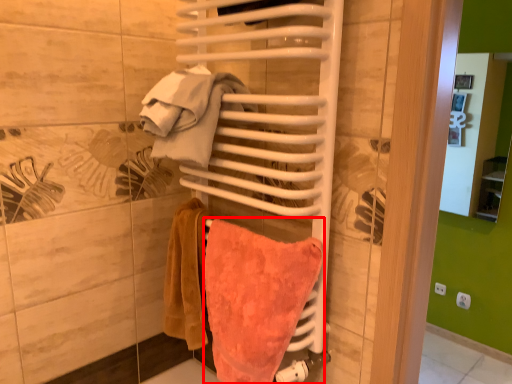
Question: From the image's perspective, what is the correct spatial positioning of towel (annotated by the red box) in reference to beach towel?

Choices:
 (A) below
 (B) above

Answer: (A)